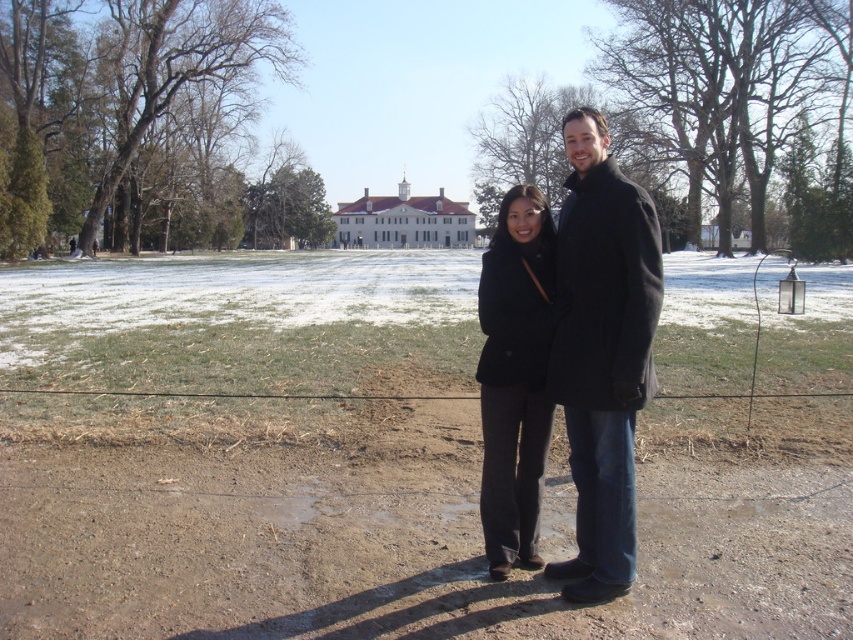
Question: Does black wool coat at center lie in front of black matte coat at center?

Choices:
 (A) yes
 (B) no

Answer: (A)

Question: Considering the relative positions of black wool coat at center and black matte coat at center in the image provided, where is black wool coat at center located with respect to black matte coat at center?

Choices:
 (A) below
 (B) above

Answer: (B)

Question: Does black wool coat at center have a greater width compared to black matte coat at center?

Choices:
 (A) no
 (B) yes

Answer: (B)

Question: Which object appears closest to the camera in this image?

Choices:
 (A) black wool coat at center
 (B) black matte coat at center

Answer: (A)

Question: Among these points, which one is nearest to the camera?

Choices:
 (A) (502, 234)
 (B) (640, 376)

Answer: (B)